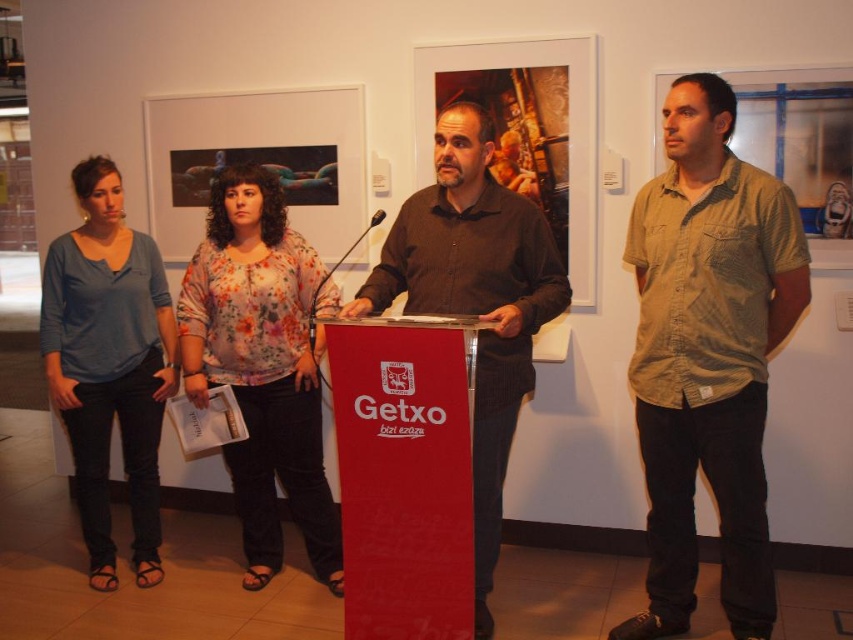
In the scene shown: Based on the scene described, where is the floral print blouse at center located in the image?

The floral print blouse at center is located at the 2D coordinates point (262, 365).

You are standing in the exhibition space and want to approach both the khaki cotton shirt at right and the dark brown shirt at center. Which shirt should you approach first to reach the one closer to you?

You should approach the khaki cotton shirt at right first because it is closer to you than the dark brown shirt at center.